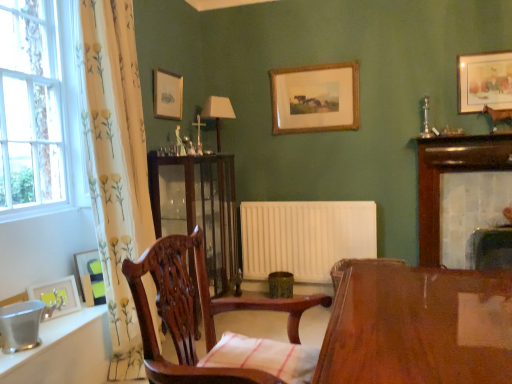
Question: In terms of height, does wooden picture frame at upper center, which ranks as the third picture frame in back-to-front order, look taller or shorter compared to matte green picture frame at lower left, positioned as the second picture frame in left-to-right order?

Choices:
 (A) tall
 (B) short

Answer: (A)

Question: Relative to matte green picture frame at lower left, arranged as the fourth picture frame when viewed from the top, is wooden picture frame at upper center, which is the 3th picture frame in left-to-right order, in front or behind?

Choices:
 (A) front
 (B) behind

Answer: (B)

Question: Which of these objects is positioned farthest from the matte green picture frame at lower left, placed as the fourth picture frame when sorted from back to front?

Choices:
 (A) matte brown lamp at center
 (B) mahogany wooden chair at center
 (C) mahogany cabinet at center
 (D) wooden picture frame at upper right, the 1th picture frame in the right-to-left sequence
 (E) matte yellow picture frame at lower left, the first picture frame from the front

Answer: (D)

Question: Considering the real-world distances, which object is closest to the brushed metal bucket at lower left?

Choices:
 (A) matte brown lamp at center
 (B) white glass window at left
 (C) white floral curtain at left
 (D) wooden picture frame at upper right, acting as the fifth picture frame starting from the bottom
 (E) white tile fireplace at upper right

Answer: (C)